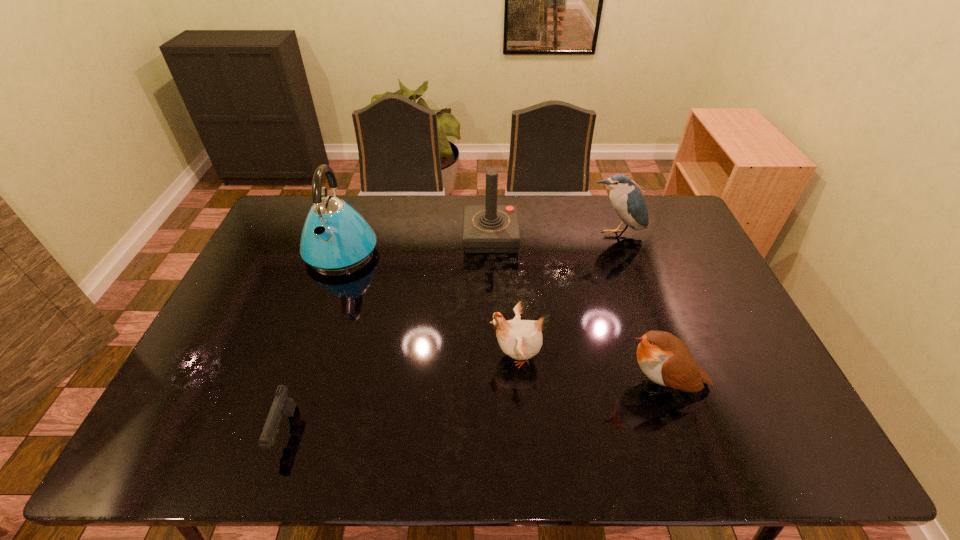
Locate an element on the screen. kettle is located at coordinates (335, 238).

This screenshot has width=960, height=540. Find the location of `joystick`. joystick is located at coordinates (490, 228).

Locate an element on the screen. The height and width of the screenshot is (540, 960). the tallest bird is located at coordinates (627, 200).

You are a GUI agent. You are given a task and a screenshot of the screen. Output one action in this format:
    pyautogui.click(x=<x>, y=<y>)
    Task: Click on the leftmost bird
    
    Given the screenshot: What is the action you would take?
    pyautogui.click(x=520, y=339)

Where is `pistol`? pistol is located at coordinates (282, 404).

Identify the location of vacant area situated at the spout of the tallest object. (313, 333).

You are a GUI agent. You are given a task and a screenshot of the screen. Output one action in this format:
    pyautogui.click(x=<x>, y=<y>)
    Task: Click on the vacant area located 0.240m on the rectangular base of the joystick
    
    Given the screenshot: What is the action you would take?
    pyautogui.click(x=395, y=238)

Identify the location of vacant space located on the rectangular base of the joystick. The image size is (960, 540). (392, 238).

The width and height of the screenshot is (960, 540). Identify the location of vacant space located on the rectangular base of the joystick. (415, 238).

You are a GUI agent. You are given a task and a screenshot of the screen. Output one action in this format:
    pyautogui.click(x=<x>, y=<y>)
    Task: Click on the vacant position located at the tip of the tallest bird's beak
    The image size is (960, 540).
    Given the screenshot: What is the action you would take?
    pyautogui.click(x=642, y=312)